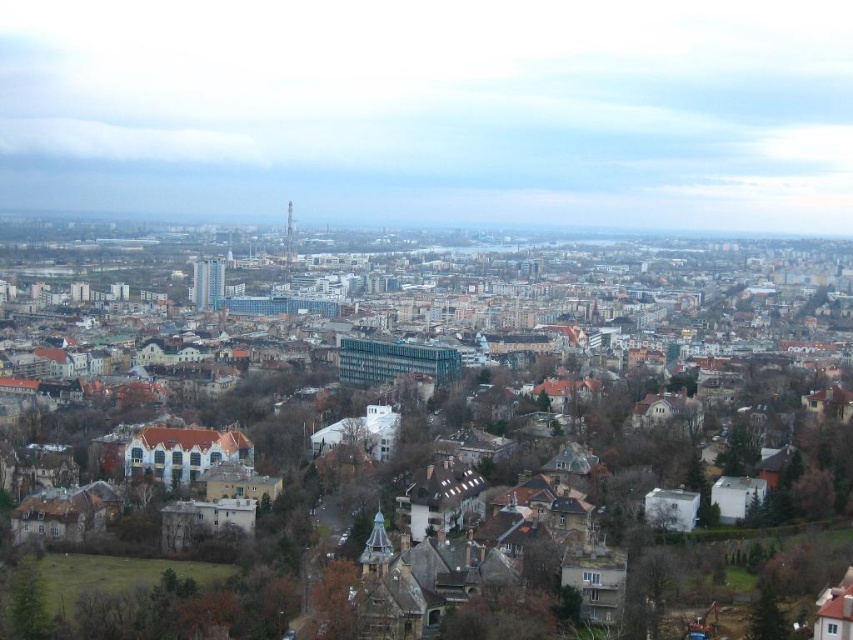
Based on the photo, who is lower down, brown stone buildings at center or brown textured tree at lower center?

brown textured tree at lower center is below.

Is point (316, 404) positioned after point (323, 632)?

Yes, point (316, 404) is behind point (323, 632).

Is point (779, 387) farther from camera compared to point (331, 564)?

Yes.

This screenshot has height=640, width=853. I want to click on brown stone buildings at center, so click(474, 464).